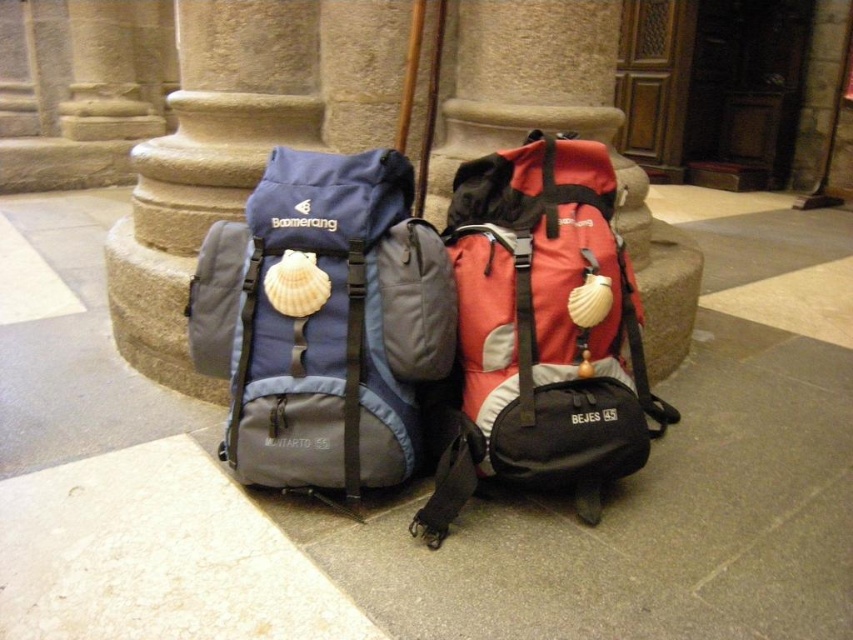
Question: Which point appears farthest from the camera in this image?

Choices:
 (A) (701, 189)
 (B) (511, 189)

Answer: (A)

Question: Is gray stone pavement at center above matte red backpack at center?

Choices:
 (A) yes
 (B) no

Answer: (A)

Question: Observing the image, what is the correct spatial positioning of gray stone pavement at center in reference to matte red backpack at center?

Choices:
 (A) below
 (B) above

Answer: (B)

Question: Among these objects, which one is farthest from the camera?

Choices:
 (A) gray stone pavement at center
 (B) matte red backpack at center

Answer: (B)

Question: Is gray stone pavement at center further to camera compared to matte red backpack at center?

Choices:
 (A) yes
 (B) no

Answer: (B)